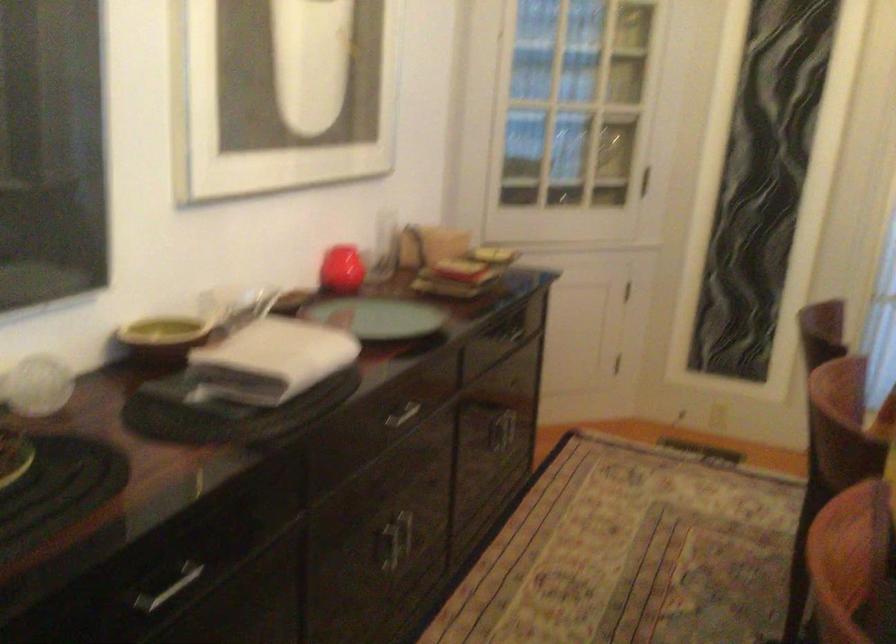
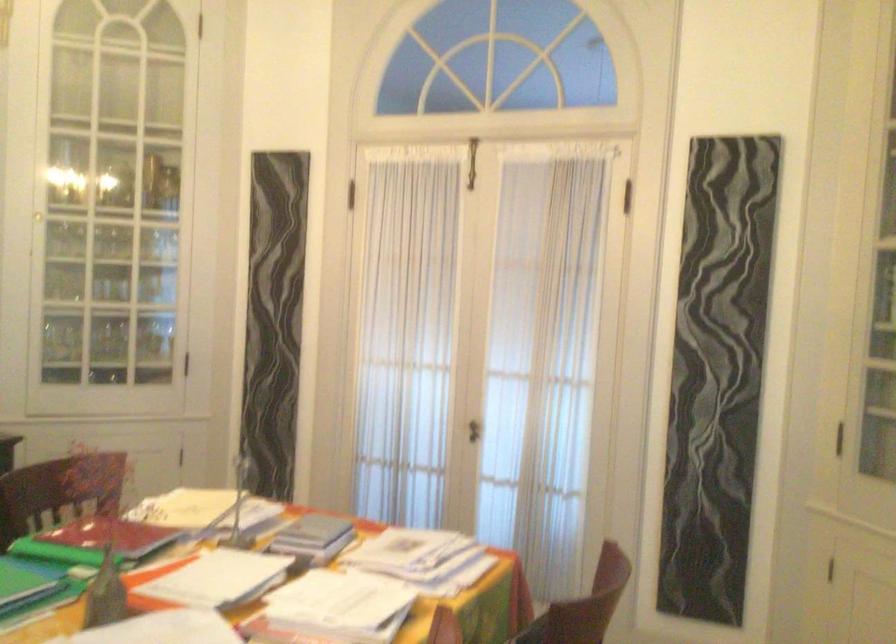
In a continuous first-person perspective shot, in which direction is the camera moving?

The cameraman walked toward right, backward.